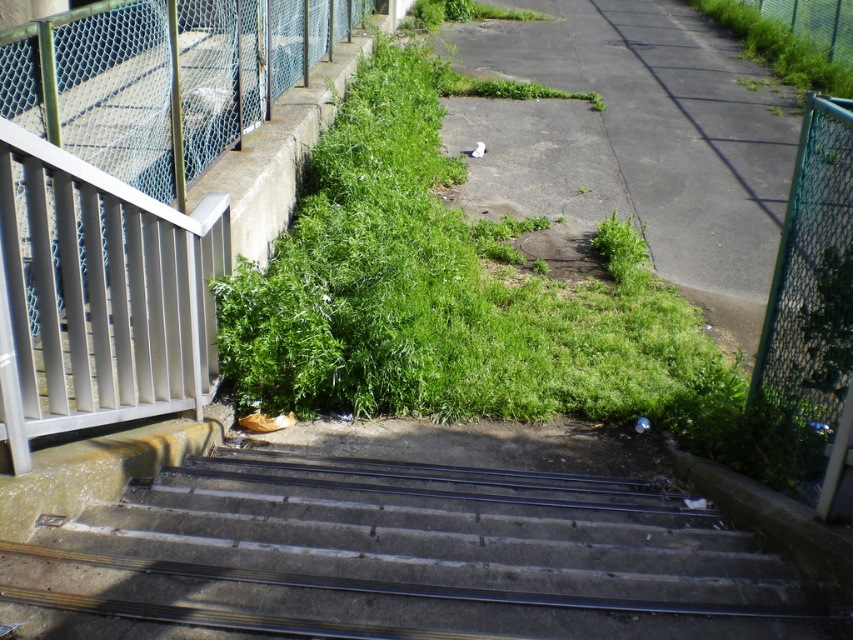
You are a maintenance worker assessing the area. You need to determine if the green mesh fence at right can be seen over the green grass at upper right. Based on the scene, what is your conclusion?

The green mesh fence at right is taller than the green grass at upper right, so yes, the fence can be seen over the grass.

You are standing at the bottom of the stairs and want to walk towards the point labeled as point (752, 32). Will you pass by the point labeled as point (648, 273) first?

Yes, you will pass by point (648, 273) first because point (752, 32) is located behind point (648, 273) from your current position at the bottom of the stairs.

You are a gardener who needs to determine which plant requires more trimming. Based on the scene, which one is taller between the green grass at upper right and the green leafy weed at center?

The green leafy weed at center is taller than the green grass at upper right, so it requires more trimming.